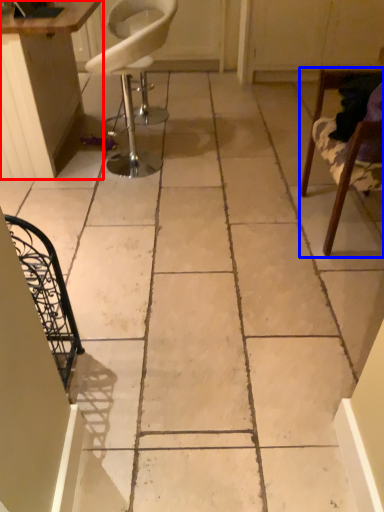
Question: Which object is further to the camera taking this photo, table (highlighted by a red box) or chair (highlighted by a blue box)?

Choices:
 (A) table
 (B) chair

Answer: (A)